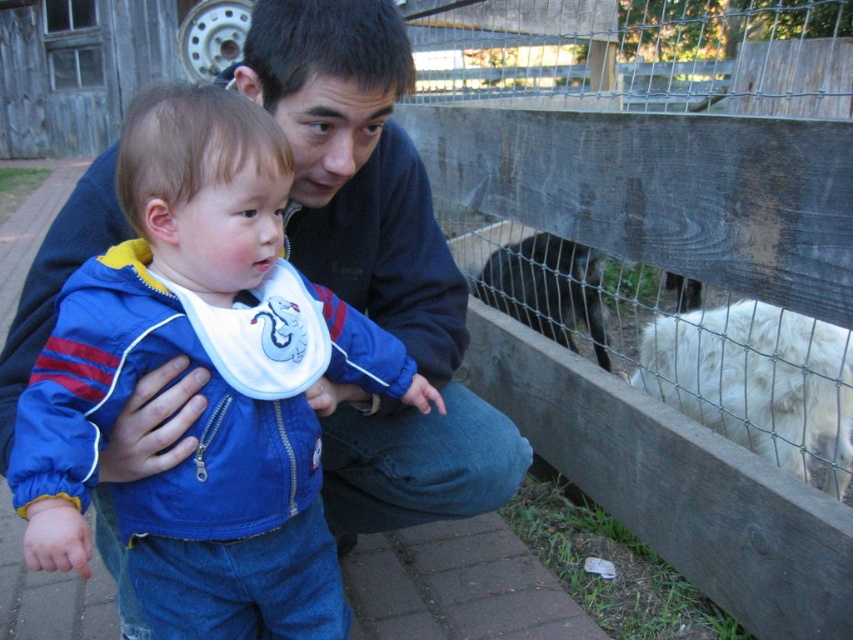
Question: Which object is positioned farthest from the wooden fence at center?

Choices:
 (A) matte blue jacket at center
 (B) dark brown fur at upper center
 (C) white fluffy sheep at right

Answer: (A)

Question: Does wooden fence at center have a smaller size compared to matte blue jacket at center?

Choices:
 (A) yes
 (B) no

Answer: (A)

Question: Is wooden fence at center further to the viewer compared to white fluffy sheep at right?

Choices:
 (A) yes
 (B) no

Answer: (A)

Question: Which of the following is the closest to the observer?

Choices:
 (A) (564, 326)
 (B) (90, 410)
 (C) (840, 132)
 (D) (733, 316)

Answer: (B)

Question: Is wooden fence at center below matte blue jacket at center?

Choices:
 (A) yes
 (B) no

Answer: (B)

Question: Among these points, which one is nearest to the camera?

Choices:
 (A) (596, 339)
 (B) (479, 289)

Answer: (B)